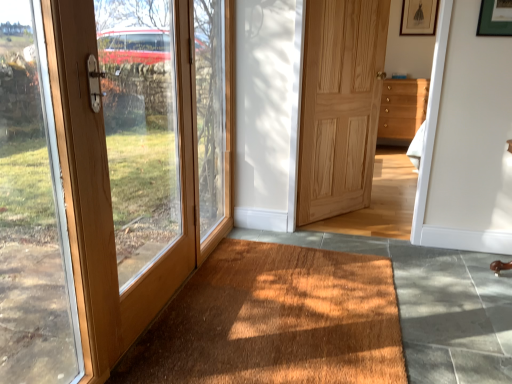
Question: Which is correct: matte black picture frame at upper right is inside wooden chest of drawers at center-right, or outside of it?

Choices:
 (A) outside
 (B) inside

Answer: (A)

Question: Considering the positions of matte black picture frame at upper right and wooden chest of drawers at center-right in the image, is matte black picture frame at upper right wider or thinner than wooden chest of drawers at center-right?

Choices:
 (A) thin
 (B) wide

Answer: (A)

Question: Estimate the real-world distances between objects in this image. Which object is closer to the matte black picture frame at upper right?

Choices:
 (A) matte wood door at left, which ranks as the 1th door in left-to-right order
 (B) wooden door at left
 (C) wooden chest of drawers at center-right
 (D) natural wood door at center, marked as the first door in a back-to-front arrangement
 (E) brown textured mat at lower center

Answer: (D)

Question: Estimate the real-world distances between objects in this image. Which object is farther from the matte wood door at left, positioned as the second door in back-to-front order?

Choices:
 (A) wooden door at left
 (B) brown textured mat at lower center
 (C) wooden chest of drawers at center-right
 (D) natural wood door at center, marked as the first door in a back-to-front arrangement
 (E) matte black picture frame at upper right

Answer: (C)